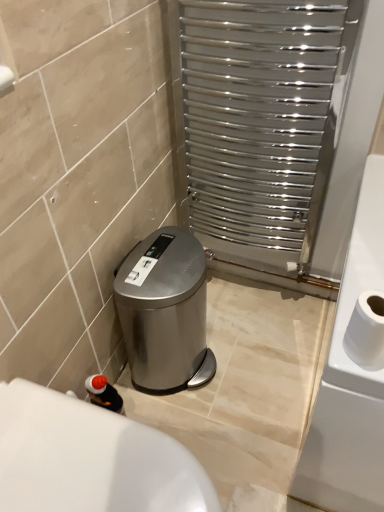
Question: Is polished stainless steel radiator at upper right further to the viewer compared to satin silver trash can at lower left?

Choices:
 (A) no
 (B) yes

Answer: (A)

Question: Is polished stainless steel radiator at upper right looking in the opposite direction of satin silver trash can at lower left?

Choices:
 (A) no
 (B) yes

Answer: (A)

Question: Considering the relative sizes of polished stainless steel radiator at upper right and satin silver trash can at lower left in the image provided, is polished stainless steel radiator at upper right shorter than satin silver trash can at lower left?

Choices:
 (A) no
 (B) yes

Answer: (A)

Question: Can you confirm if polished stainless steel radiator at upper right is positioned to the left of satin silver trash can at lower left?

Choices:
 (A) no
 (B) yes

Answer: (A)

Question: From a real-world perspective, is polished stainless steel radiator at upper right located beneath satin silver trash can at lower left?

Choices:
 (A) no
 (B) yes

Answer: (A)

Question: Looking at their shapes, would you say satin silver trash can at lower left is wider or thinner than white glossy bath at lower left?

Choices:
 (A) wide
 (B) thin

Answer: (B)

Question: Is satin silver trash can at lower left in front of or behind white glossy bath at lower left in the image?

Choices:
 (A) front
 (B) behind

Answer: (B)

Question: From the image's perspective, is satin silver trash can at lower left positioned above or below white glossy bath at lower left?

Choices:
 (A) above
 (B) below

Answer: (A)

Question: Considering the positions of satin silver trash can at lower left and white glossy bath at lower left in the image, is satin silver trash can at lower left bigger or smaller than white glossy bath at lower left?

Choices:
 (A) big
 (B) small

Answer: (B)

Question: Based on their positions, is satin silver trash can at lower left located to the left or right of white matte toilet paper at right?

Choices:
 (A) left
 (B) right

Answer: (A)

Question: Considering their positions, is satin silver trash can at lower left located in front of or behind white matte toilet paper at right?

Choices:
 (A) behind
 (B) front

Answer: (A)

Question: Is satin silver trash can at lower left inside the boundaries of white matte toilet paper at right, or outside?

Choices:
 (A) outside
 (B) inside

Answer: (A)

Question: From a real-world perspective, is satin silver trash can at lower left physically located above or below white matte toilet paper at right?

Choices:
 (A) below
 (B) above

Answer: (A)

Question: From a real-world perspective, is polished stainless steel radiator at upper right physically located above or below white glossy bath at lower left?

Choices:
 (A) above
 (B) below

Answer: (A)

Question: Which is correct: polished stainless steel radiator at upper right is inside white glossy bath at lower left, or outside of it?

Choices:
 (A) outside
 (B) inside

Answer: (A)